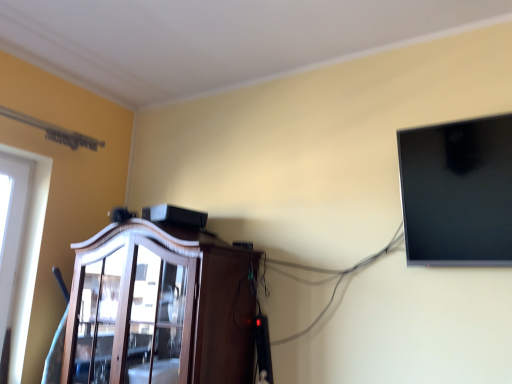
Question: From a real-world perspective, is dark wood cabinet at center located higher than matte black monitor at upper right?

Choices:
 (A) yes
 (B) no

Answer: (B)

Question: Is dark wood cabinet at center far away from matte black monitor at upper right?

Choices:
 (A) no
 (B) yes

Answer: (A)

Question: From the image's perspective, is dark wood cabinet at center beneath matte black monitor at upper right?

Choices:
 (A) yes
 (B) no

Answer: (A)

Question: Can you confirm if dark wood cabinet at center is thinner than matte black monitor at upper right?

Choices:
 (A) no
 (B) yes

Answer: (A)

Question: Is dark wood cabinet at center touching matte black monitor at upper right?

Choices:
 (A) yes
 (B) no

Answer: (B)

Question: Considering the relative sizes of dark wood cabinet at center and matte black monitor at upper right in the image provided, is dark wood cabinet at center bigger than matte black monitor at upper right?

Choices:
 (A) no
 (B) yes

Answer: (B)

Question: From the image's perspective, is matte black monitor at upper right under dark wood cabinet at center?

Choices:
 (A) yes
 (B) no

Answer: (B)

Question: From a real-world perspective, is matte black monitor at upper right on top of dark wood cabinet at center?

Choices:
 (A) yes
 (B) no

Answer: (A)

Question: Can you confirm if matte black monitor at upper right is wider than dark wood cabinet at center?

Choices:
 (A) no
 (B) yes

Answer: (A)

Question: Considering the relative sizes of matte black monitor at upper right and dark wood cabinet at center in the image provided, is matte black monitor at upper right thinner than dark wood cabinet at center?

Choices:
 (A) no
 (B) yes

Answer: (B)

Question: Is matte black monitor at upper right located outside dark wood cabinet at center?

Choices:
 (A) no
 (B) yes

Answer: (B)

Question: Does matte black monitor at upper right appear on the left side of dark wood cabinet at center?

Choices:
 (A) no
 (B) yes

Answer: (A)

Question: From their relative heights in the image, would you say matte black monitor at upper right is taller or shorter than dark wood cabinet at center?

Choices:
 (A) tall
 (B) short

Answer: (B)